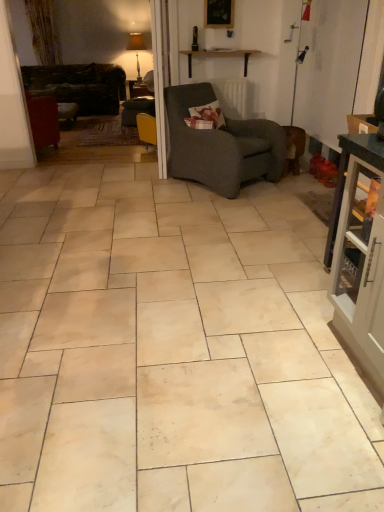
Question: Is beige marble tile at center looking in the opposite direction of dark brown leather couch at left?

Choices:
 (A) no
 (B) yes

Answer: (A)

Question: Can you confirm if beige marble tile at center is bigger than dark brown leather couch at left?

Choices:
 (A) no
 (B) yes

Answer: (A)

Question: Can you confirm if beige marble tile at center is thinner than dark brown leather couch at left?

Choices:
 (A) yes
 (B) no

Answer: (B)

Question: From a real-world perspective, is beige marble tile at center physically below dark brown leather couch at left?

Choices:
 (A) yes
 (B) no

Answer: (A)

Question: Would you say beige marble tile at center contains dark brown leather couch at left?

Choices:
 (A) yes
 (B) no

Answer: (B)

Question: Is beige marble tile at center behind dark brown leather couch at left?

Choices:
 (A) no
 (B) yes

Answer: (A)

Question: Considering the relative sizes of matte white lampshade at upper center and floral fabric pillow at center in the image provided, is matte white lampshade at upper center smaller than floral fabric pillow at center?

Choices:
 (A) yes
 (B) no

Answer: (B)

Question: Is matte white lampshade at upper center thinner than floral fabric pillow at center?

Choices:
 (A) no
 (B) yes

Answer: (A)

Question: Considering the relative sizes of matte white lampshade at upper center and floral fabric pillow at center in the image provided, is matte white lampshade at upper center taller than floral fabric pillow at center?

Choices:
 (A) no
 (B) yes

Answer: (B)

Question: Does matte white lampshade at upper center appear on the right side of floral fabric pillow at center?

Choices:
 (A) no
 (B) yes

Answer: (A)

Question: Considering the relative positions of matte white lampshade at upper center and floral fabric pillow at center in the image provided, is matte white lampshade at upper center to the left of floral fabric pillow at center from the viewer's perspective?

Choices:
 (A) yes
 (B) no

Answer: (A)

Question: Is matte white lampshade at upper center outside of floral fabric pillow at center?

Choices:
 (A) no
 (B) yes

Answer: (B)

Question: Is matte gray cabinet at right oriented away from dark gray textured armchair at center?

Choices:
 (A) no
 (B) yes

Answer: (A)